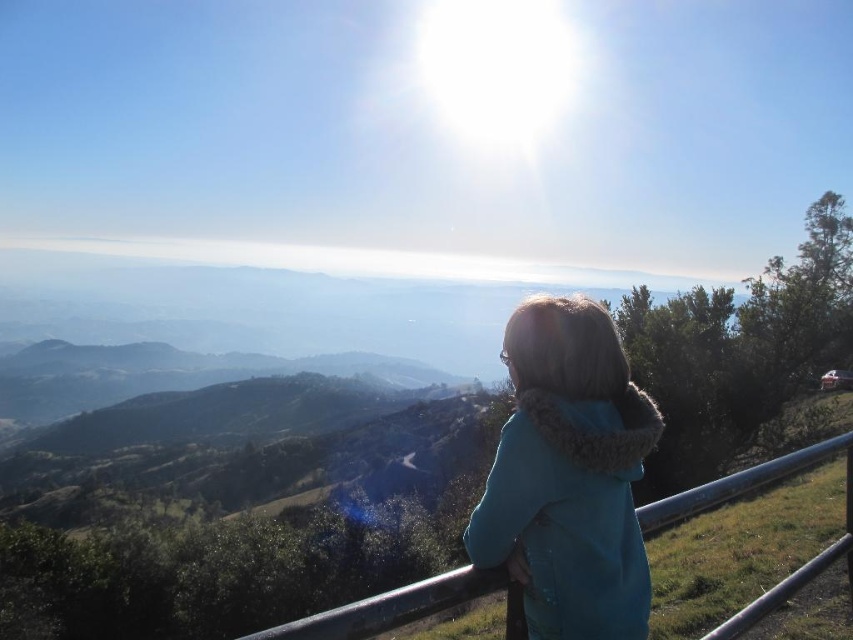
Which is above, teal fur-trimmed coat at center or metallic rail at lower right?

Positioned higher is teal fur-trimmed coat at center.

From the picture: Is teal fur-trimmed coat at center to the right of metallic rail at lower right from the viewer's perspective?

Incorrect, teal fur-trimmed coat at center is not on the right side of metallic rail at lower right.

Does point (543, 301) come closer to viewer compared to point (283, 637)?

No, it is behind (283, 637).

Where is `teal fur-trimmed coat at center`? The width and height of the screenshot is (853, 640). teal fur-trimmed coat at center is located at coordinates (567, 476).